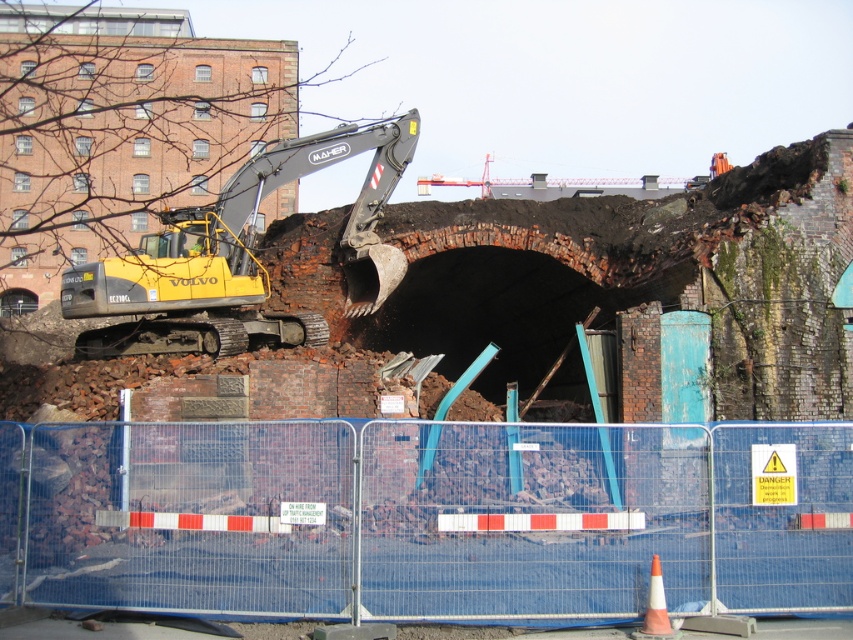
Does blue mesh fence at center have a lesser width compared to yellow rubber excavator at left?

Incorrect, blue mesh fence at center's width is not less than yellow rubber excavator at left's.

Does point (575, 424) come in front of point (361, 225)?

Yes, it is in front of point (361, 225).

Find the location of `blue mesh fence at center`. blue mesh fence at center is located at coordinates (426, 516).